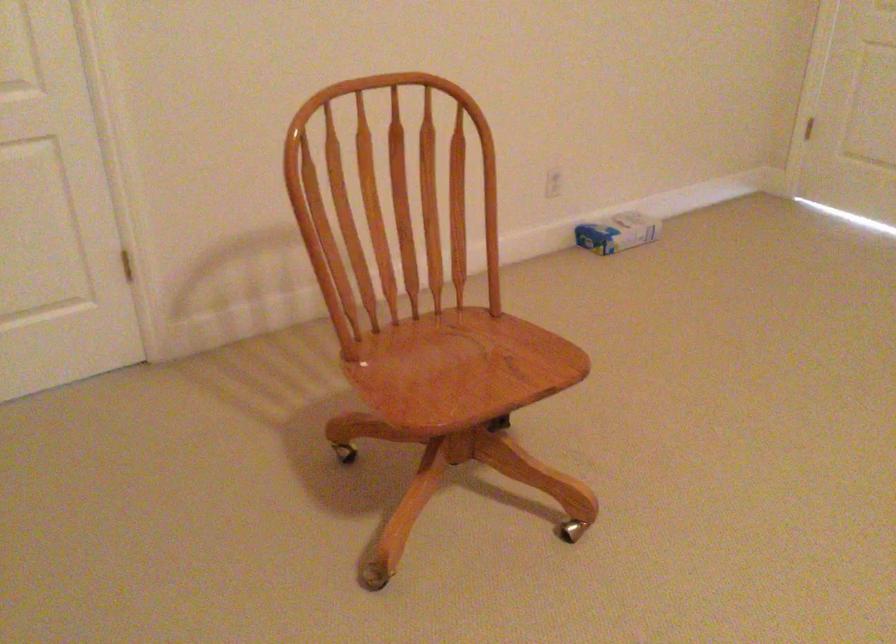
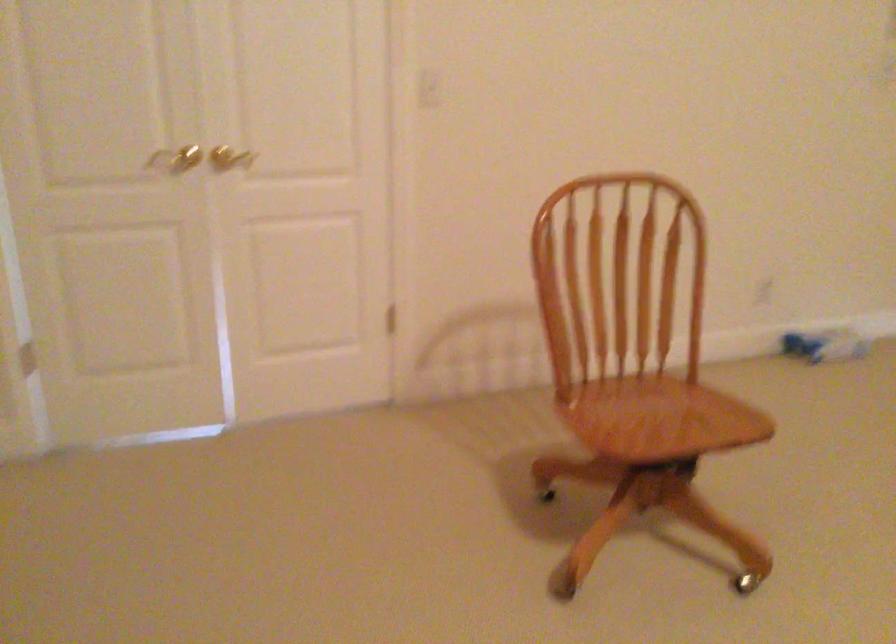
Question: The first image is from the beginning of the video and the second image is from the end. How did the camera likely rotate when shooting the video?

Choices:
 (A) Left
 (B) Right
 (C) Up
 (D) Down

Answer: (A)